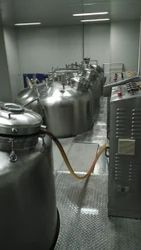
Find the location of `white background wall`. white background wall is located at coordinates (26, 41), (71, 42), (36, 63), (8, 81), (104, 47), (122, 29), (127, 59).